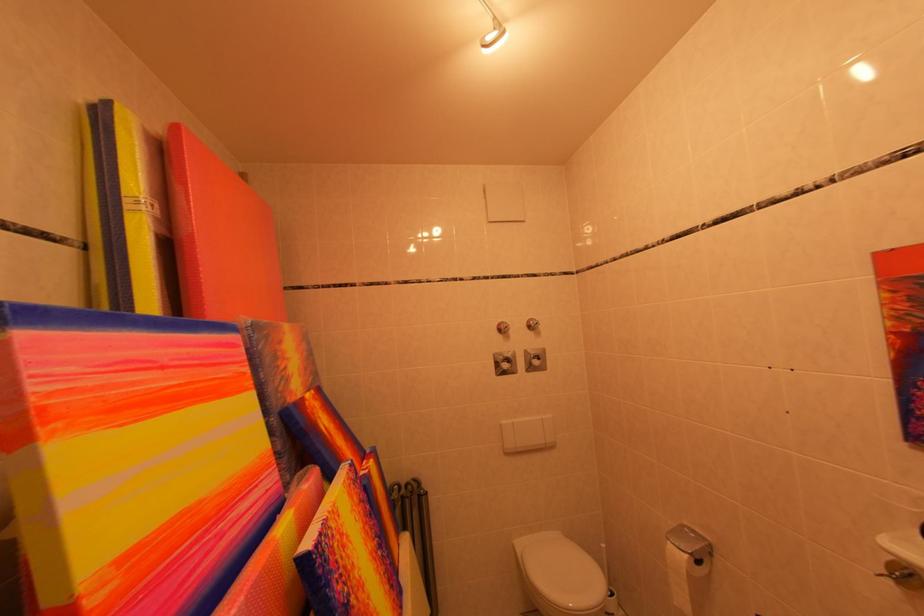
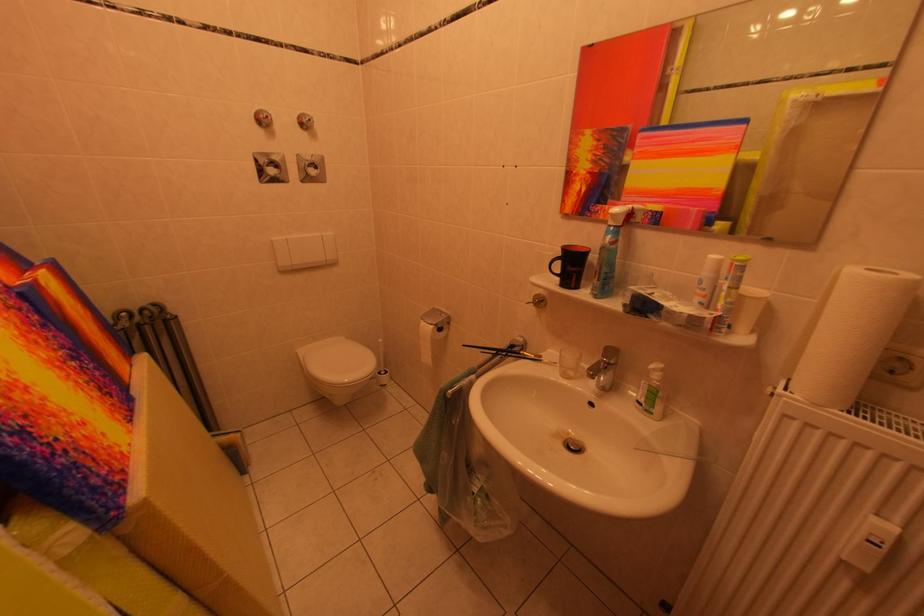
Where in the second image is the point corresponding to (528,548) from the first image?

(311, 355)